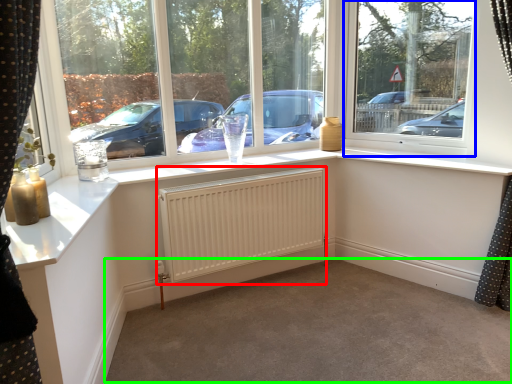
Question: Which is farther away from radiator (highlighted by a red box)? window screen (highlighted by a blue box) or plain (highlighted by a green box)?

Choices:
 (A) window screen
 (B) plain

Answer: (A)